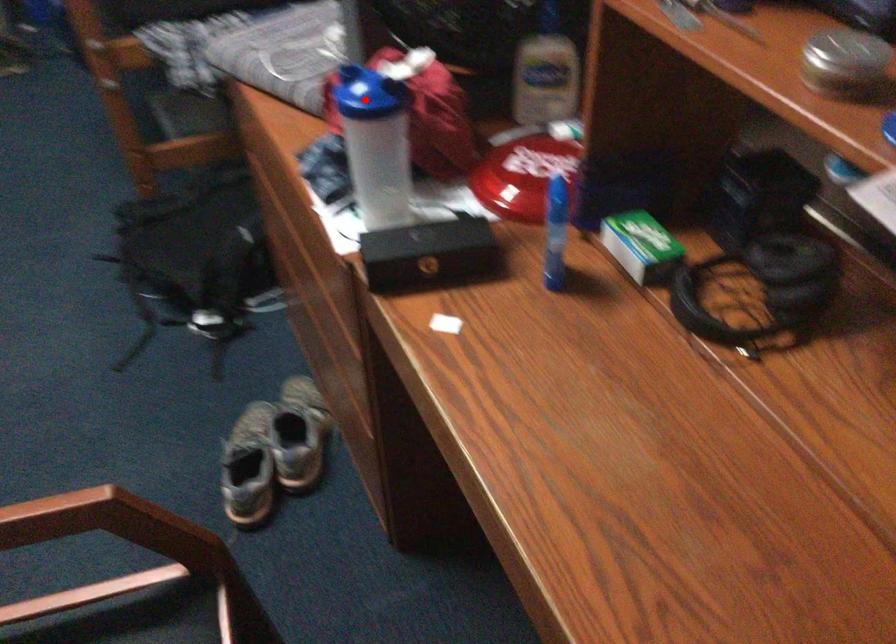
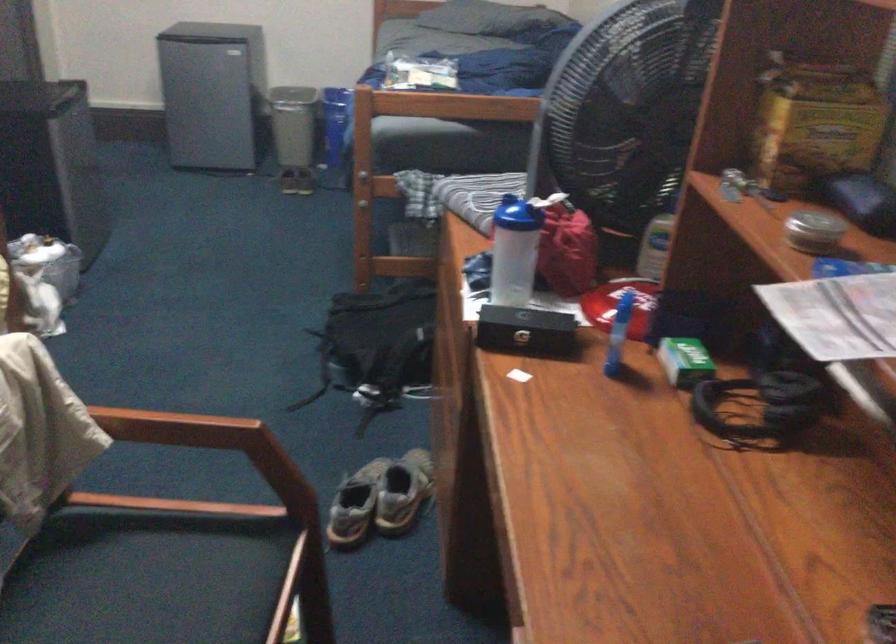
Where in the second image is the point corresponding to the highlighted location from the first image?

(510, 214)